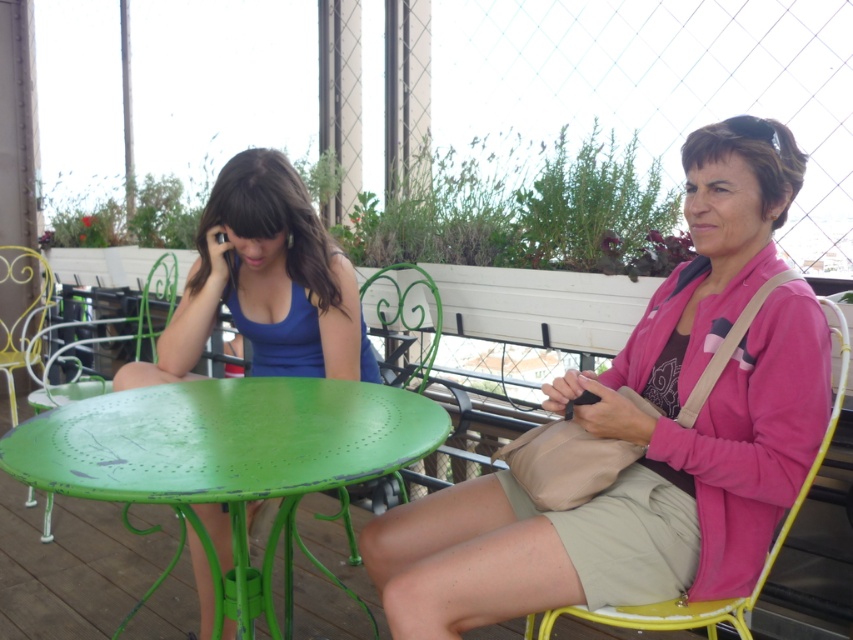
Can you confirm if pink fabric jacket at upper right is bigger than yellow metal chair at right?

Indeed, pink fabric jacket at upper right has a larger size compared to yellow metal chair at right.

Does point (704, 234) come behind point (683, 604)?

Yes, it is behind point (683, 604).

At what (x,y) coordinates should I click in order to perform the action: click on pink fabric jacket at upper right. Please return your answer as a coordinate pair (x, y). Looking at the image, I should click on (647, 433).

The image size is (853, 640). I want to click on pink fabric jacket at upper right, so click(647, 433).

Is the position of pink fabric jacket at upper right more distant than that of blue matte tank top at center?

No, it is not.

Can you confirm if pink fabric jacket at upper right is positioned above blue matte tank top at center?

Incorrect, pink fabric jacket at upper right is not positioned above blue matte tank top at center.

Which is behind, point (693, 484) or point (210, 593)?

The point (210, 593) is more distant.

Find the location of a particular element. The width and height of the screenshot is (853, 640). pink fabric jacket at upper right is located at coordinates (647, 433).

Does point (206, 618) come in front of point (746, 611)?

That is False.

Who is more distant from viewer, (277, 275) or (722, 604)?

Positioned behind is point (277, 275).

At what (x,y) coordinates should I click in order to perform the action: click on blue matte tank top at center. Please return your answer as a coordinate pair (x, y). Image resolution: width=853 pixels, height=640 pixels. Looking at the image, I should click on (265, 284).